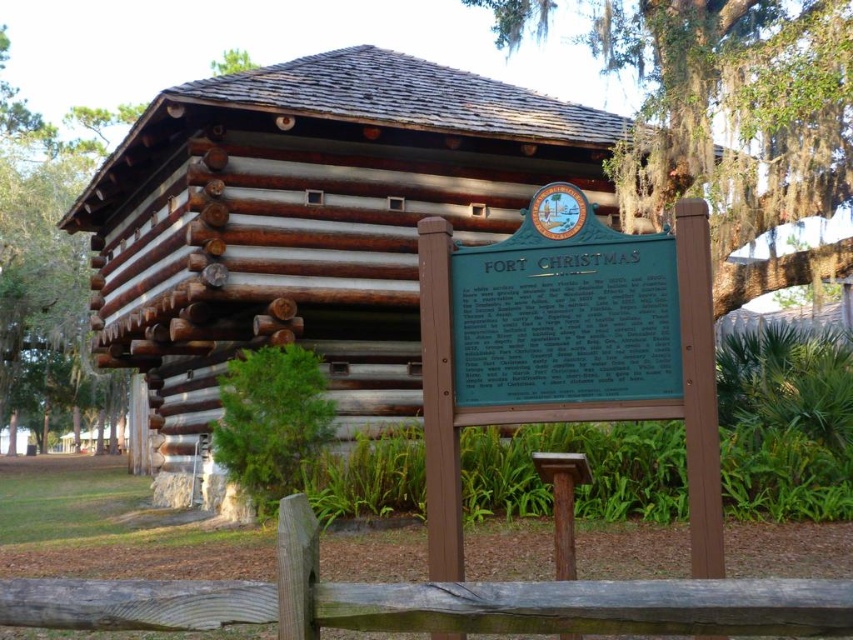
Question: From the image, what is the correct spatial relationship of green plaque at center in relation to weathered wood fence at lower center?

Choices:
 (A) left
 (B) right

Answer: (B)

Question: Which object is the closest to the weathered wood fence at lower center?

Choices:
 (A) green leafy tree at upper center
 (B) green mossy tree at upper right
 (C) green leafy tree at left
 (D) green metal sign at center

Answer: (D)

Question: Which point appears farthest from the camera in this image?

Choices:
 (A) (811, 1)
 (B) (302, 419)
 (C) (247, 61)

Answer: (C)

Question: Is green plaque at center smaller than green leafy tree at left?

Choices:
 (A) no
 (B) yes

Answer: (B)

Question: Estimate the real-world distances between objects in this image. Which object is farther from the weathered wood fence at lower center?

Choices:
 (A) green mossy tree at upper right
 (B) green metal sign at center
 (C) green leafy tree at upper center
 (D) green leafy tree at lower left

Answer: (C)

Question: Is green plaque at center to the right of weathered wood fence at lower center from the viewer's perspective?

Choices:
 (A) yes
 (B) no

Answer: (A)